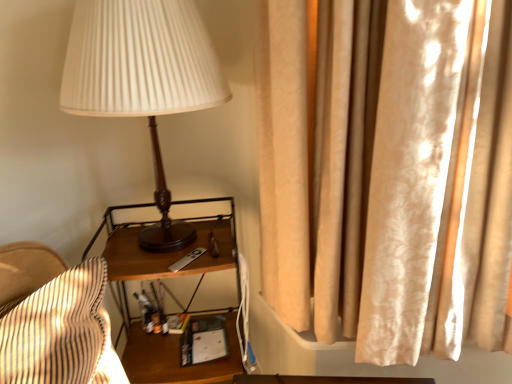
Question: Is the surface of wooden nightstand at center in direct contact with silky beige curtain at right?

Choices:
 (A) no
 (B) yes

Answer: (A)

Question: Is wooden nightstand at center bigger than silky beige curtain at right?

Choices:
 (A) no
 (B) yes

Answer: (B)

Question: From the image's perspective, is wooden nightstand at center on silky beige curtain at right?

Choices:
 (A) no
 (B) yes

Answer: (A)

Question: Is wooden nightstand at center facing towards silky beige curtain at right?

Choices:
 (A) yes
 (B) no

Answer: (B)

Question: Does wooden nightstand at center have a smaller size compared to silky beige curtain at right?

Choices:
 (A) yes
 (B) no

Answer: (B)

Question: In terms of height, does silky beige curtain at right look taller or shorter compared to matte wood lamp at center?

Choices:
 (A) short
 (B) tall

Answer: (B)

Question: From a real-world perspective, relative to matte wood lamp at center, is silky beige curtain at right vertically above or below?

Choices:
 (A) below
 (B) above

Answer: (A)

Question: Is silky beige curtain at right bigger or smaller than matte wood lamp at center?

Choices:
 (A) big
 (B) small

Answer: (A)

Question: Is silky beige curtain at right wider or thinner than matte wood lamp at center?

Choices:
 (A) thin
 (B) wide

Answer: (A)

Question: From their relative heights in the image, would you say wooden nightstand at center is taller or shorter than matte wood lamp at center?

Choices:
 (A) short
 (B) tall

Answer: (B)

Question: Looking at their shapes, would you say wooden nightstand at center is wider or thinner than matte wood lamp at center?

Choices:
 (A) thin
 (B) wide

Answer: (A)

Question: Based on their sizes in the image, would you say wooden nightstand at center is bigger or smaller than matte wood lamp at center?

Choices:
 (A) big
 (B) small

Answer: (A)

Question: Considering the positions of point (183, 372) and point (138, 74), is point (183, 372) closer or farther from the camera than point (138, 74)?

Choices:
 (A) closer
 (B) farther

Answer: (B)

Question: From the image's perspective, is matte wood lamp at center positioned above or below wooden nightstand at center?

Choices:
 (A) above
 (B) below

Answer: (A)

Question: Would you say matte wood lamp at center is inside or outside wooden nightstand at center?

Choices:
 (A) outside
 (B) inside

Answer: (A)